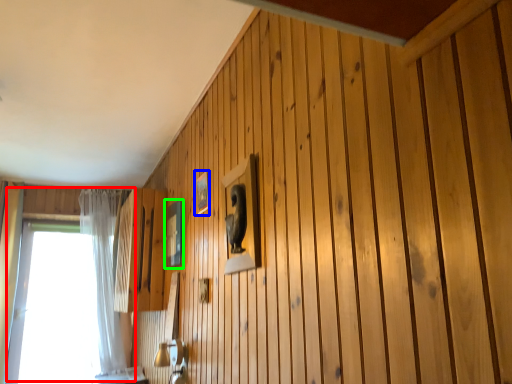
Question: Which object is positioned farthest from window (highlighted by a red box)? Select from picture frame (highlighted by a blue box) and picture frame (highlighted by a green box).

Choices:
 (A) picture frame
 (B) picture frame

Answer: (A)